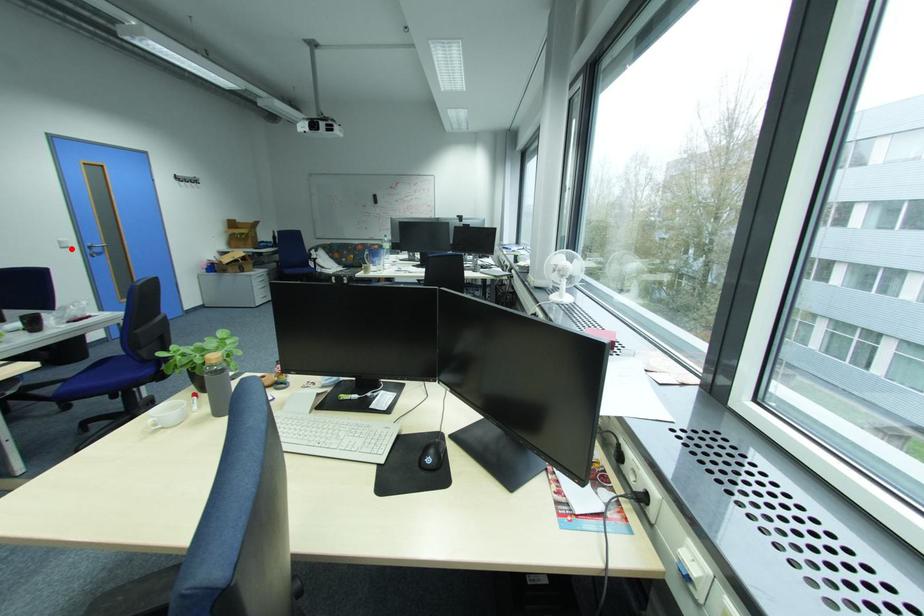
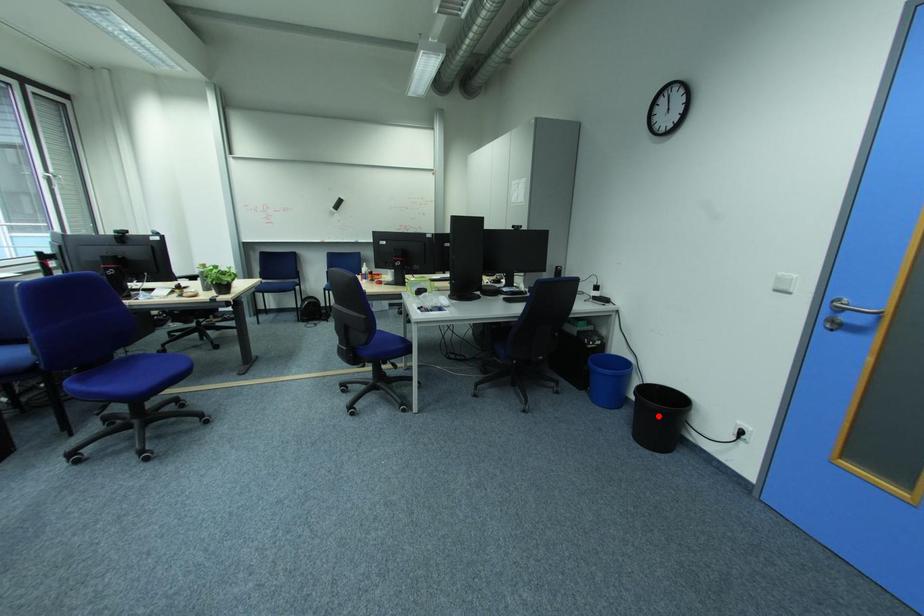
I am providing you with two images of the same scene from different viewpoints. A red point is marked on the first image and another point is marked on the second image. Is the red point in image1 aligned with the point shown in image2?

No